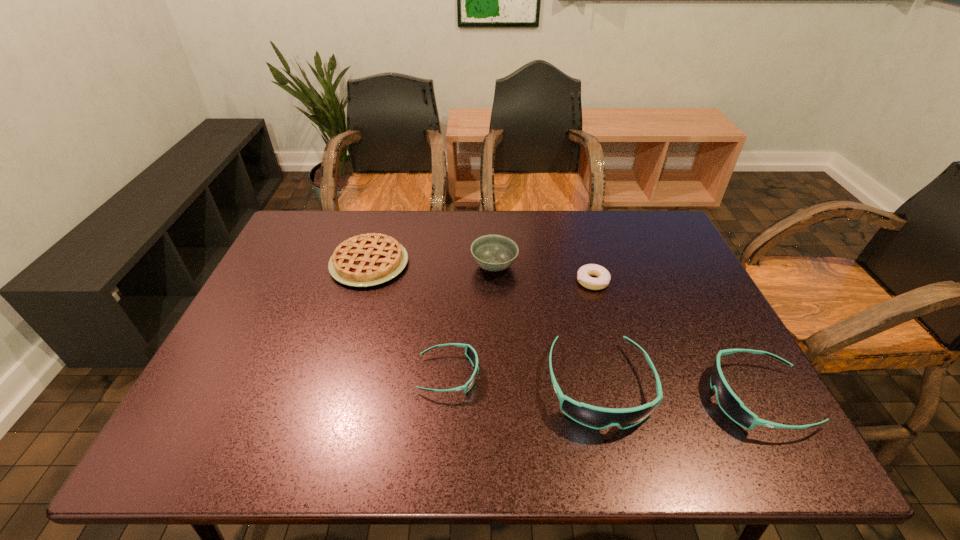
The image size is (960, 540). I want to click on blank space located 0.220m on the front-facing side of the second tallest sunglasses, so click(609, 397).

This screenshot has height=540, width=960. Find the location of `vacant area situated 0.400m on the left of the doughnut`. vacant area situated 0.400m on the left of the doughnut is located at coordinates (436, 281).

This screenshot has height=540, width=960. Find the location of `vacant space located on the front of the bowl`. vacant space located on the front of the bowl is located at coordinates (497, 350).

The image size is (960, 540). Find the location of `free space located on the left of the leftmost object`. free space located on the left of the leftmost object is located at coordinates (270, 264).

I want to click on bowl that is at the far edge, so click(494, 253).

Where is `pie that is at the far edge`? pie that is at the far edge is located at coordinates (364, 260).

Locate an element on the screen. The height and width of the screenshot is (540, 960). object that is at the right edge is located at coordinates (731, 405).

Identify the location of object at the near right corner. The height and width of the screenshot is (540, 960). (731, 405).

In the image, there is a desktop. Where is `free region at the far edge`? free region at the far edge is located at coordinates (534, 238).

Identify the location of vacant space at the near edge. (304, 392).